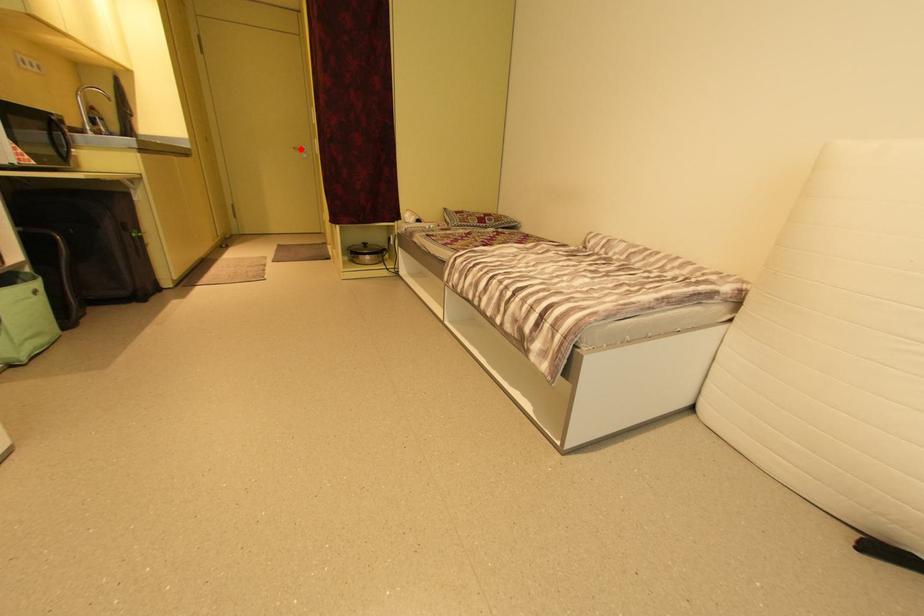
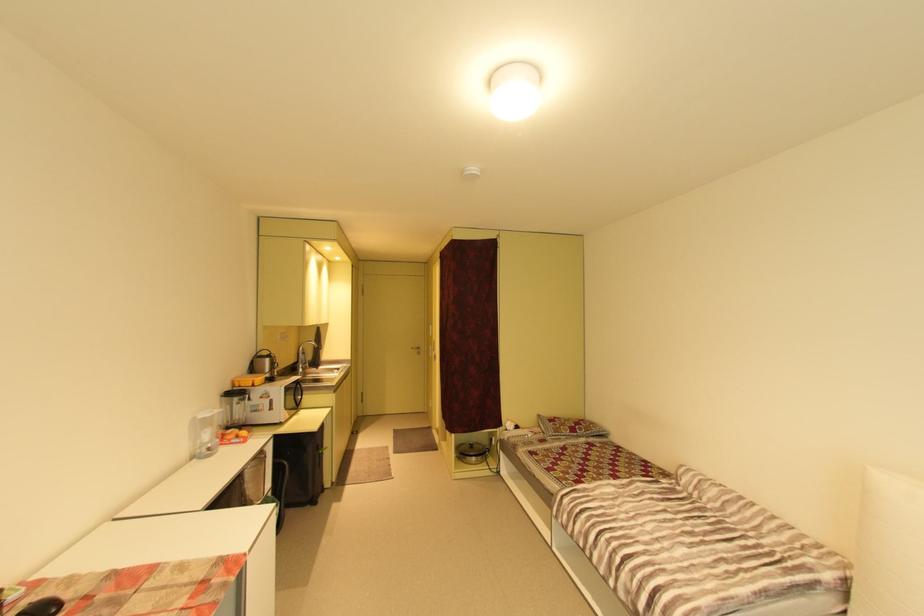
Question: I am providing you with two images of the same scene from different viewpoints. A red point is marked on the first image. Is the red point's position out of view in image 2?

Choices:
 (A) Yes
 (B) No

Answer: (B)